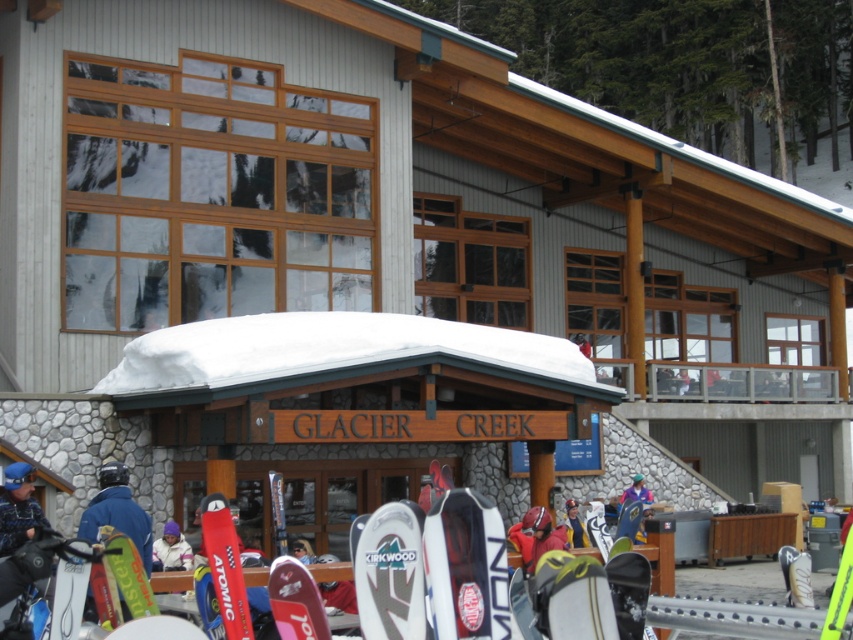
Who is higher up, yellow matte ski at lower center or blue matte jacket at lower left?

Positioned higher is yellow matte ski at lower center.

The width and height of the screenshot is (853, 640). What do you see at coordinates (572, 596) in the screenshot?
I see `yellow matte ski at lower center` at bounding box center [572, 596].

Is point (566, 552) farther from camera compared to point (120, 506)?

Yes, it is.

Find the location of a particular element. The image size is (853, 640). yellow matte ski at lower center is located at coordinates (572, 596).

From the picture: Who is lower down, matte red ski at lower center or blue fabric jacket at center?

blue fabric jacket at center is lower down.

Measure the distance between matte red ski at lower center and camera.

matte red ski at lower center and camera are 8.50 meters apart.

Identify the location of matte red ski at lower center. The height and width of the screenshot is (640, 853). (294, 600).

What do you see at coordinates (225, 564) in the screenshot?
I see `red matte ski at center` at bounding box center [225, 564].

Does red matte ski at center appear over blue fleece jacket at lower left?

Indeed, red matte ski at center is positioned over blue fleece jacket at lower left.

Between point (245, 624) and point (9, 524), which one is positioned behind?

Positioned behind is point (9, 524).

Find the location of a particular element. The height and width of the screenshot is (640, 853). red matte ski at center is located at coordinates (225, 564).